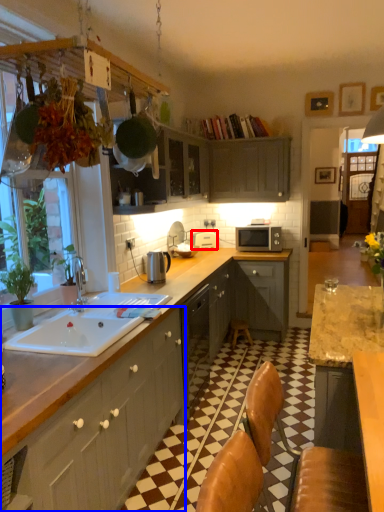
Question: Which object is closer to the camera taking this photo, appliance (highlighted by a red box) or cabinetry (highlighted by a blue box)?

Choices:
 (A) appliance
 (B) cabinetry

Answer: (B)